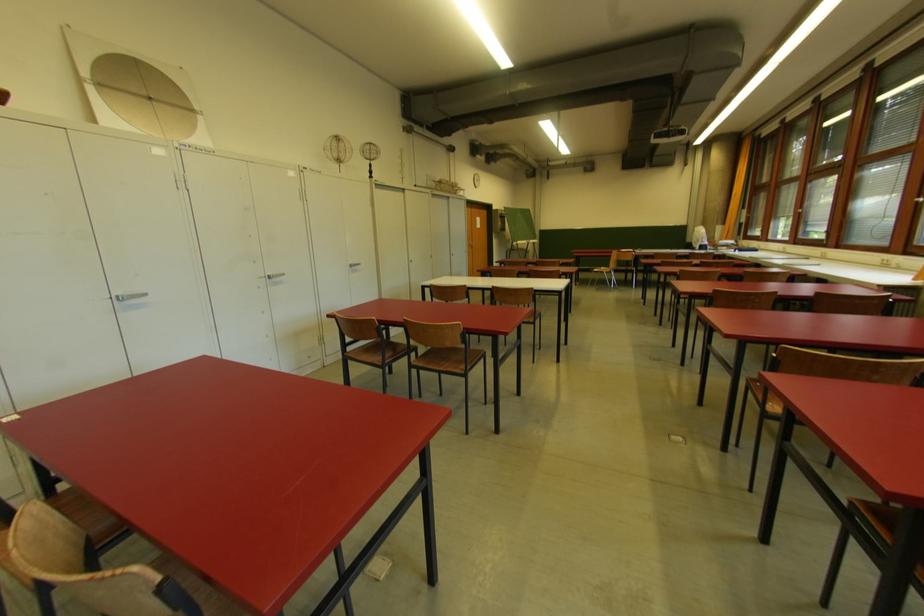
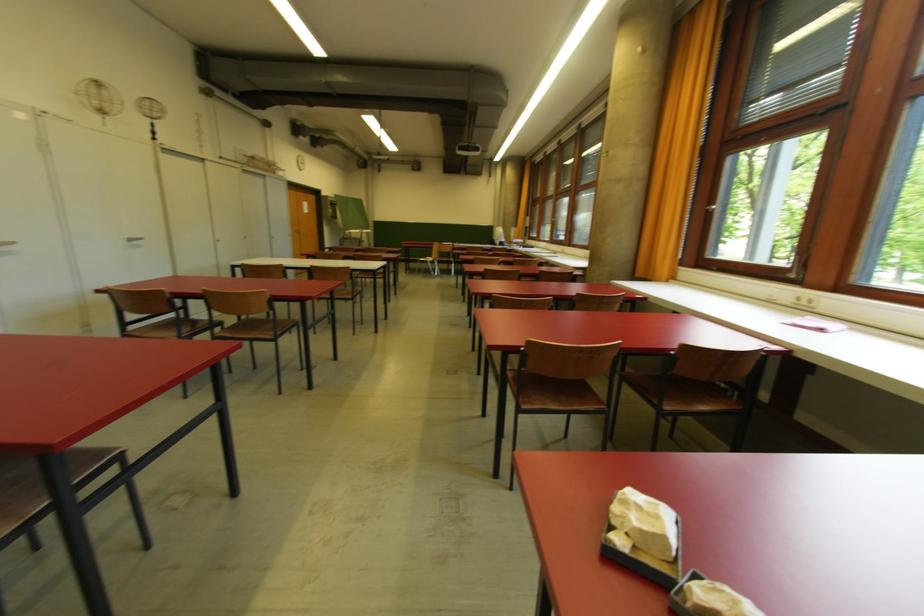
Find the pixel in the second image that matches pixel 353 265 in the first image.

(130, 238)